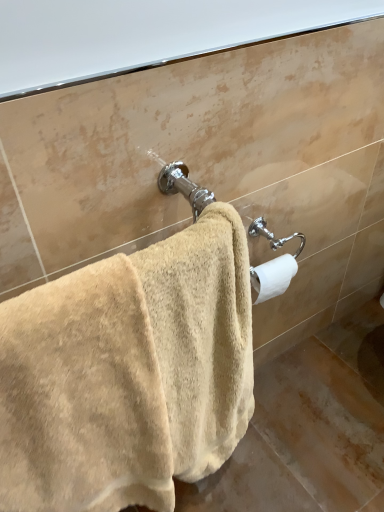
Question: Is beige plush towel at center bigger than white matte toilet paper at right?

Choices:
 (A) yes
 (B) no

Answer: (A)

Question: Is beige plush towel at center not near white matte toilet paper at right?

Choices:
 (A) no
 (B) yes

Answer: (A)

Question: Is beige plush towel at center behind white matte toilet paper at right?

Choices:
 (A) no
 (B) yes

Answer: (A)

Question: Considering the relative sizes of beige plush towel at center and white matte toilet paper at right in the image provided, is beige plush towel at center wider than white matte toilet paper at right?

Choices:
 (A) yes
 (B) no

Answer: (A)

Question: Considering the relative sizes of beige plush towel at center and white matte toilet paper at right in the image provided, is beige plush towel at center smaller than white matte toilet paper at right?

Choices:
 (A) no
 (B) yes

Answer: (A)

Question: Is beige plush towel at center at the left side of white matte toilet paper at right?

Choices:
 (A) no
 (B) yes

Answer: (B)

Question: Is white matte toilet paper at right not near beige plush towel at center?

Choices:
 (A) no
 (B) yes

Answer: (A)

Question: Can you confirm if white matte toilet paper at right is positioned to the left of beige plush towel at center?

Choices:
 (A) no
 (B) yes

Answer: (A)

Question: From a real-world perspective, is white matte toilet paper at right on top of beige plush towel at center?

Choices:
 (A) no
 (B) yes

Answer: (B)

Question: From the image's perspective, is white matte toilet paper at right under beige plush towel at center?

Choices:
 (A) yes
 (B) no

Answer: (B)

Question: From a real-world perspective, is white matte toilet paper at right located beneath beige plush towel at center?

Choices:
 (A) yes
 (B) no

Answer: (B)

Question: Is the depth of white matte toilet paper at right less than that of beige plush towel at center?

Choices:
 (A) no
 (B) yes

Answer: (A)

Question: In terms of size, does white matte toilet paper at right appear bigger or smaller than beige plush towel at center?

Choices:
 (A) small
 (B) big

Answer: (A)